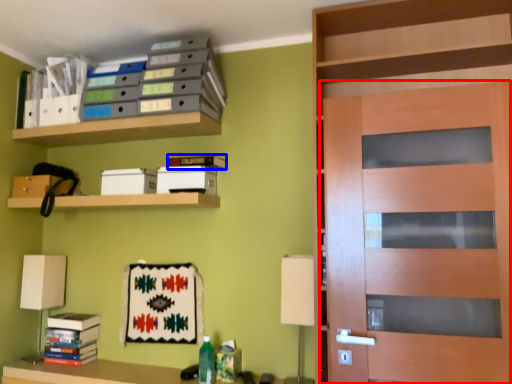
Question: Which point is further to the camera, door (highlighted by a red box) or book (highlighted by a blue box)?

Choices:
 (A) door
 (B) book

Answer: (B)